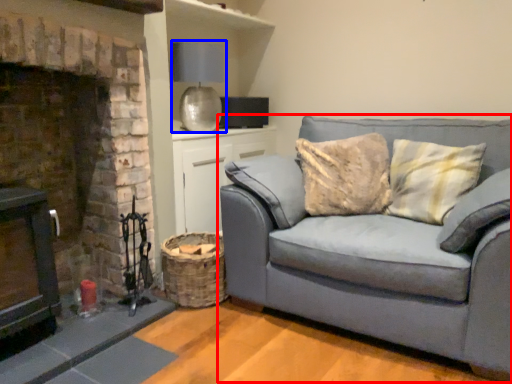
Question: Which point is further to the camera, studio couch (highlighted by a red box) or lamp (highlighted by a blue box)?

Choices:
 (A) studio couch
 (B) lamp

Answer: (B)